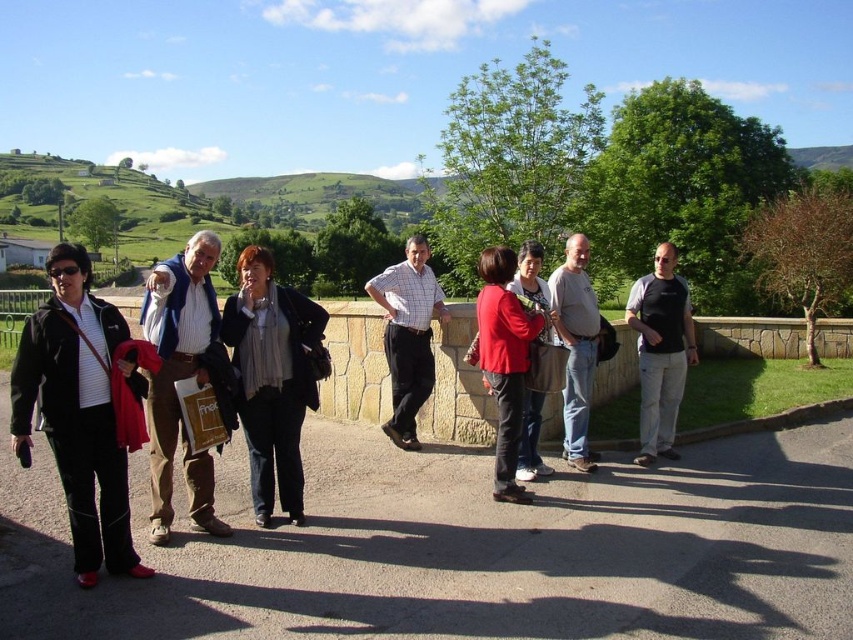
Can you confirm if matte black jacket at left is thinner than gray cotton shirt at center?

No.

Is point (74, 346) closer to viewer compared to point (576, 426)?

That is True.

Is point (50, 356) positioned after point (570, 346)?

No, it is in front of (570, 346).

The height and width of the screenshot is (640, 853). I want to click on matte black jacket at left, so click(79, 410).

Between matte red jacket at center and gray cotton shirt at center, which one is positioned higher?

Positioned higher is gray cotton shirt at center.

Looking at this image, can you confirm if matte red jacket at center is shorter than gray cotton shirt at center?

Yes, matte red jacket at center is shorter than gray cotton shirt at center.

Find the location of a particular element. matte red jacket at center is located at coordinates (x=503, y=360).

In the scene shown: Does matte blue jacket at left lie behind matte red sweater at center?

No.

Who is more distant from viewer, (187, 266) or (540, 417)?

The point (540, 417) is more distant.

In the scene shown: Who is more forward, (167, 340) or (537, 259)?

Point (167, 340) is more forward.

Locate an element on the screen. This screenshot has width=853, height=640. matte blue jacket at left is located at coordinates (183, 378).